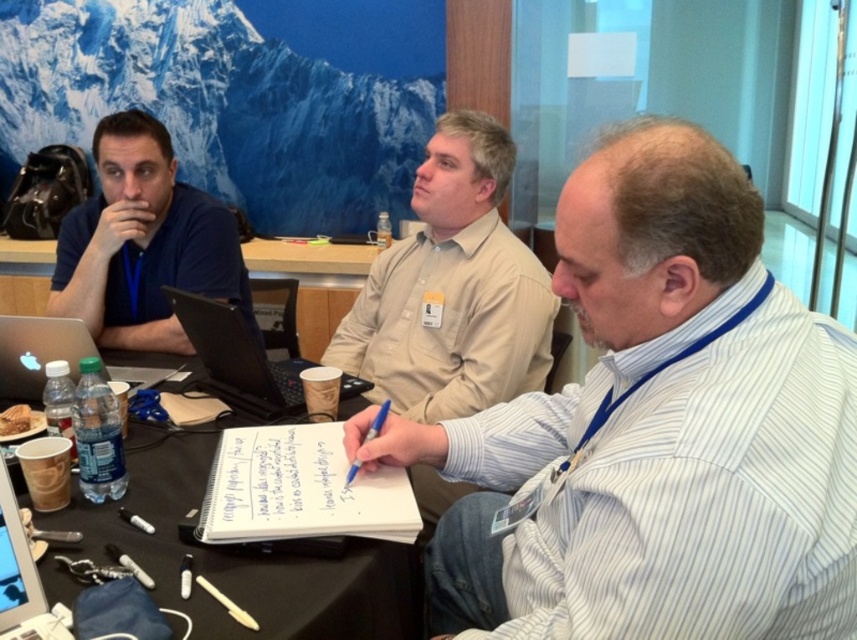
Question: Which object appears closest to the camera in this image?

Choices:
 (A) black plastic laptop at center
 (B) blue plastic pen at center
 (C) silver metallic laptop at left

Answer: (B)

Question: Estimate the real-world distances between objects in this image. Which object is farther from the silver metallic laptop at left?

Choices:
 (A) beige cotton shirt at center
 (B) white striped shirt at center

Answer: (B)

Question: Does black plastic table at center appear on the left side of blue plastic pen at center?

Choices:
 (A) no
 (B) yes

Answer: (B)

Question: Estimate the real-world distances between objects in this image. Which object is closer to the beige cotton shirt at center?

Choices:
 (A) white striped shirt at center
 (B) matte blue shirt at left
 (C) blue plastic pen at center

Answer: (B)

Question: Where is beige cotton shirt at center located in relation to silver metallic laptop at left in the image?

Choices:
 (A) above
 (B) below

Answer: (A)

Question: In this image, where is black plastic table at center located relative to silver metallic laptop at center?

Choices:
 (A) above
 (B) below

Answer: (A)